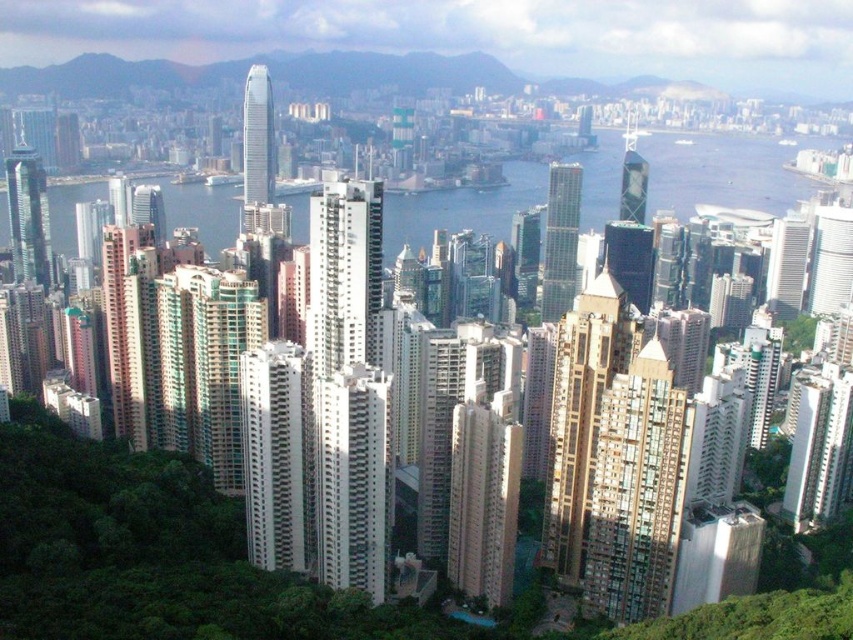
You are a GUI agent. You are given a task and a screenshot of the screen. Output one action in this format:
    pyautogui.click(x=<x>, y=<y>)
    Task: Click on the green glass skyscraper at center
    
    Given the screenshot: What is the action you would take?
    pyautogui.click(x=560, y=240)

Does point (549, 243) lie behind point (265, 72)?

No, it is in front of (265, 72).

Image resolution: width=853 pixels, height=640 pixels. Identify the location of green glass skyscraper at center. (560, 240).

Between white smooth building at center and white glossy building at center-right, which one is positioned lower?

white glossy building at center-right is lower down.

Does point (260, 444) come farther from viewer compared to point (814, 420)?

No, (260, 444) is closer to viewer.

Identify the location of white smooth building at center. The image size is (853, 640). click(273, 454).

Image resolution: width=853 pixels, height=640 pixels. I want to click on white smooth building at center, so click(x=273, y=454).

Can you confirm if shiny glass skyscraper at left is positioned above green glass skyscraper at center?

Correct, shiny glass skyscraper at left is located above green glass skyscraper at center.

Is shiny glass skyscraper at left below green glass skyscraper at center?

No, shiny glass skyscraper at left is not below green glass skyscraper at center.

Find the location of a particular element. This screenshot has width=853, height=640. shiny glass skyscraper at left is located at coordinates (28, 216).

At what (x,y) coordinates should I click in order to perform the action: click on shiny glass skyscraper at left. Please return your answer as a coordinate pair (x, y). Looking at the image, I should click on (28, 216).